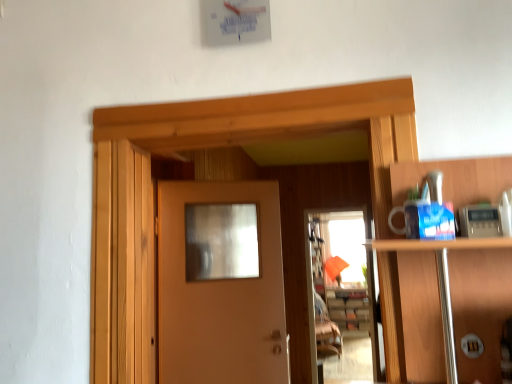
Question: Considering the positions of wooden cabinet at center and matte wood door at center in the image, is wooden cabinet at center wider or thinner than matte wood door at center?

Choices:
 (A) wide
 (B) thin

Answer: (A)

Question: Would you say wooden cabinet at center is to the left or to the right of matte wood door at center in the picture?

Choices:
 (A) right
 (B) left

Answer: (A)

Question: Estimate the real-world distances between objects in this image. Which object is closer to the matte wood door at center?

Choices:
 (A) wooden cabinet at center
 (B) translucent glass screen door at center

Answer: (B)

Question: Estimate the real-world distances between objects in this image. Which object is farther from the matte wood door at center?

Choices:
 (A) translucent glass screen door at center
 (B) wooden cabinet at center

Answer: (B)